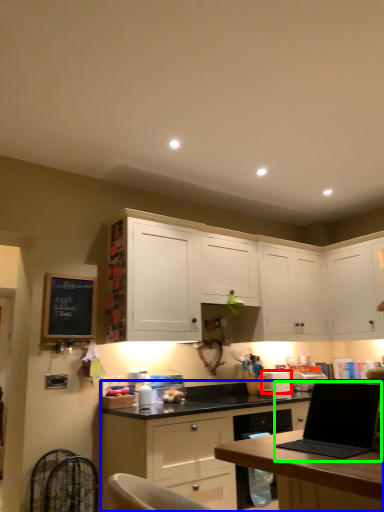
Question: Which is farther away from appliance (highlighted by a red box)? cabinetry (highlighted by a blue box) or laptop (highlighted by a green box)?

Choices:
 (A) cabinetry
 (B) laptop

Answer: (B)